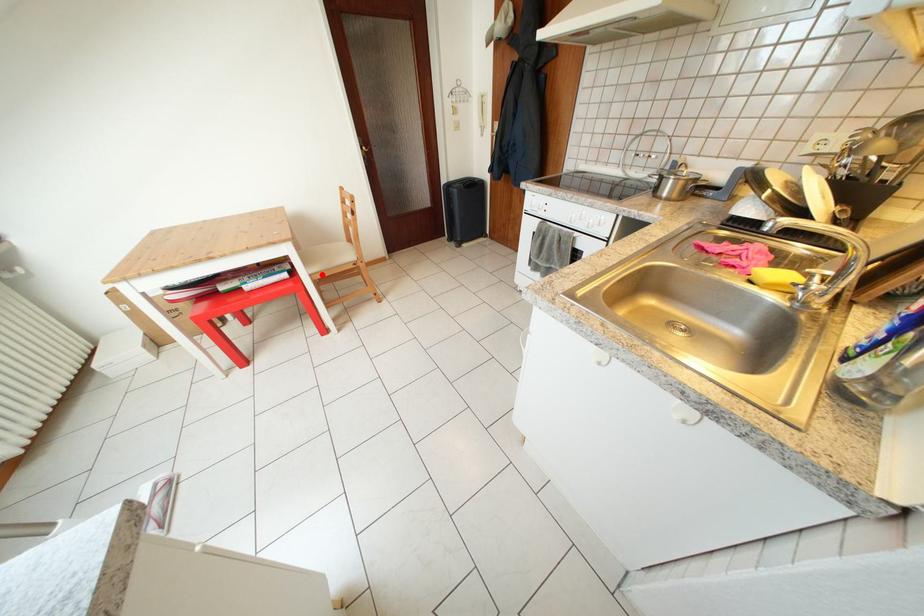
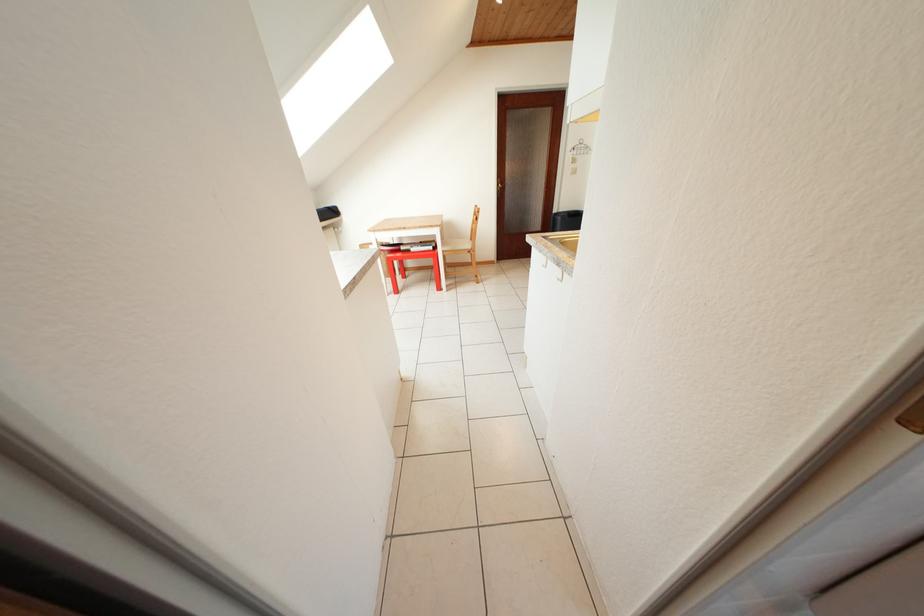
Find the pixel in the second image that matches the highlighted location in the first image.

(454, 254)